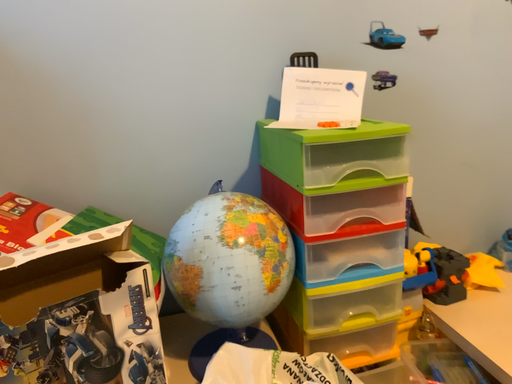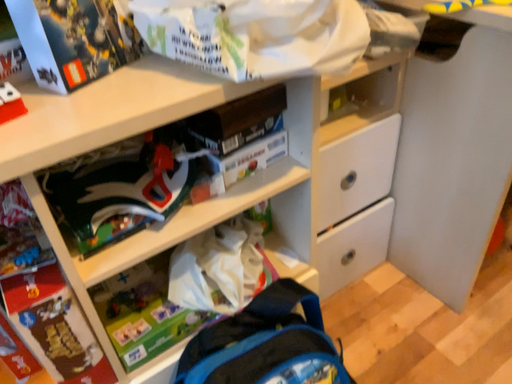
Question: Which way did the camera rotate in the video?

Choices:
 (A) rotated left
 (B) rotated right

Answer: (B)